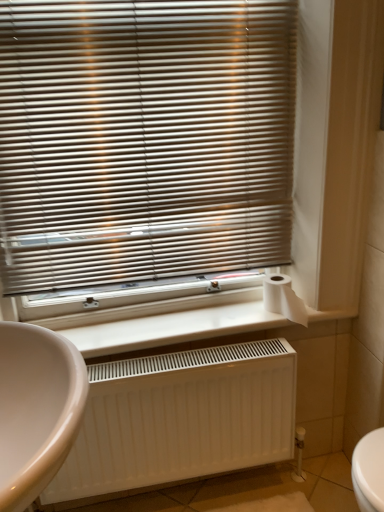
Question: Is white matte radiator at lower center thinner than white matte toilet paper at right?

Choices:
 (A) yes
 (B) no

Answer: (B)

Question: Considering the relative sizes of white matte radiator at lower center and white matte toilet paper at right in the image provided, is white matte radiator at lower center taller than white matte toilet paper at right?

Choices:
 (A) yes
 (B) no

Answer: (B)

Question: Does white matte radiator at lower center lie in front of white matte toilet paper at right?

Choices:
 (A) yes
 (B) no

Answer: (A)

Question: Can you confirm if white matte radiator at lower center is wider than white matte toilet paper at right?

Choices:
 (A) no
 (B) yes

Answer: (B)

Question: Is white matte radiator at lower center not near white matte toilet paper at right?

Choices:
 (A) yes
 (B) no

Answer: (B)

Question: Is white matte radiator at lower center oriented away from white matte toilet paper at right?

Choices:
 (A) no
 (B) yes

Answer: (A)

Question: From a real-world perspective, is metallic blinds at upper center below white matte toilet paper at right?

Choices:
 (A) no
 (B) yes

Answer: (A)

Question: Considering the relative positions of metallic blinds at upper center and white matte toilet paper at right in the image provided, is metallic blinds at upper center behind white matte toilet paper at right?

Choices:
 (A) no
 (B) yes

Answer: (A)

Question: Is metallic blinds at upper center not within white matte toilet paper at right?

Choices:
 (A) no
 (B) yes

Answer: (B)

Question: Is metallic blinds at upper center shorter than white matte toilet paper at right?

Choices:
 (A) no
 (B) yes

Answer: (A)

Question: Is metallic blinds at upper center to the left of white matte toilet paper at right from the viewer's perspective?

Choices:
 (A) no
 (B) yes

Answer: (B)

Question: Is metallic blinds at upper center thinner than white matte toilet paper at right?

Choices:
 (A) yes
 (B) no

Answer: (A)

Question: Does white matte radiator at lower center appear on the right side of white matte radiator at lower center?

Choices:
 (A) yes
 (B) no

Answer: (A)